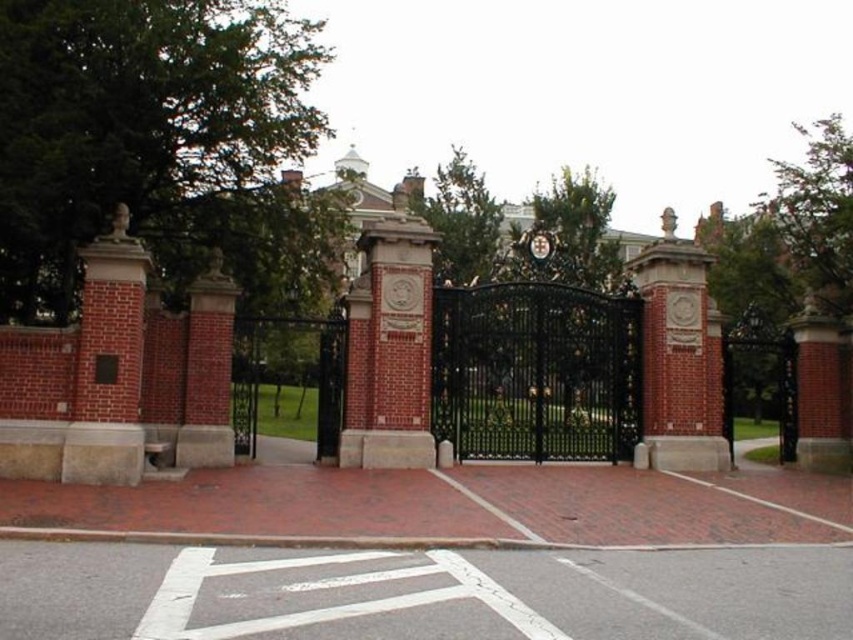
Question: Is black wrought iron gate at center smaller than metallic clock at center?

Choices:
 (A) no
 (B) yes

Answer: (A)

Question: Is black wrought iron gate at center positioned behind metallic clock at center?

Choices:
 (A) yes
 (B) no

Answer: (B)

Question: Which point is farther from the camera taking this photo?

Choices:
 (A) (503, 284)
 (B) (534, 234)

Answer: (B)

Question: Which of the following is the closest to the observer?

Choices:
 (A) (550, 298)
 (B) (529, 243)

Answer: (A)

Question: Where is black wrought iron gate at center located in relation to metallic clock at center in the image?

Choices:
 (A) left
 (B) right

Answer: (A)

Question: Among these objects, which one is nearest to the camera?

Choices:
 (A) black wrought iron gate at center
 (B) metallic clock at center

Answer: (A)